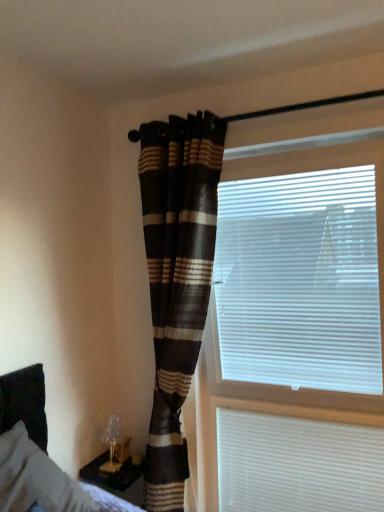
Question: Is white plastic blinds at lower right, the second window blind positioned from the top, positioned beyond the bounds of white plastic blinds at right, which ranks as the first window blind in top-to-bottom order?

Choices:
 (A) no
 (B) yes

Answer: (B)

Question: Does white plastic blinds at lower right, arranged as the 1th window blind when ordered from the bottom, come behind white plastic blinds at right, which is the 2th window blind in bottom-to-top order?

Choices:
 (A) no
 (B) yes

Answer: (B)

Question: Is white plastic blinds at lower right, arranged as the 1th window blind when ordered from the bottom, next to white plastic blinds at right, which ranks as the first window blind in top-to-bottom order, and touching it?

Choices:
 (A) no
 (B) yes

Answer: (A)

Question: From the image's perspective, is white plastic blinds at lower right, arranged as the 1th window blind when ordered from the bottom, above white plastic blinds at right, which ranks as the first window blind in top-to-bottom order?

Choices:
 (A) no
 (B) yes

Answer: (A)

Question: Is white plastic blinds at lower right, arranged as the 1th window blind when ordered from the bottom, shorter than white plastic blinds at right, which ranks as the first window blind in top-to-bottom order?

Choices:
 (A) yes
 (B) no

Answer: (A)

Question: Is white plastic blinds at lower right, arranged as the 1th window blind when ordered from the bottom, thinner than white plastic blinds at right, which is the 2th window blind in bottom-to-top order?

Choices:
 (A) no
 (B) yes

Answer: (B)

Question: Does white plastic blinds at right, which ranks as the first window blind in top-to-bottom order, have a greater width compared to plaid fabric curtain at center?

Choices:
 (A) no
 (B) yes

Answer: (A)

Question: Is white plastic blinds at right, which ranks as the first window blind in top-to-bottom order, next to plaid fabric curtain at center and touching it?

Choices:
 (A) yes
 (B) no

Answer: (B)

Question: Is white plastic blinds at right, which is the 2th window blind in bottom-to-top order, to the right of plaid fabric curtain at center from the viewer's perspective?

Choices:
 (A) yes
 (B) no

Answer: (A)

Question: From a real-world perspective, is white plastic blinds at right, which ranks as the first window blind in top-to-bottom order, located beneath plaid fabric curtain at center?

Choices:
 (A) no
 (B) yes

Answer: (A)

Question: Can you confirm if white plastic blinds at right, which ranks as the first window blind in top-to-bottom order, is positioned to the left of plaid fabric curtain at center?

Choices:
 (A) no
 (B) yes

Answer: (A)

Question: Is white plastic blinds at right, which is the 2th window blind in bottom-to-top order, located outside plaid fabric curtain at center?

Choices:
 (A) no
 (B) yes

Answer: (B)

Question: Can you confirm if plaid fabric curtain at center is wider than white plastic blinds at right, which is the 2th window blind in bottom-to-top order?

Choices:
 (A) yes
 (B) no

Answer: (A)